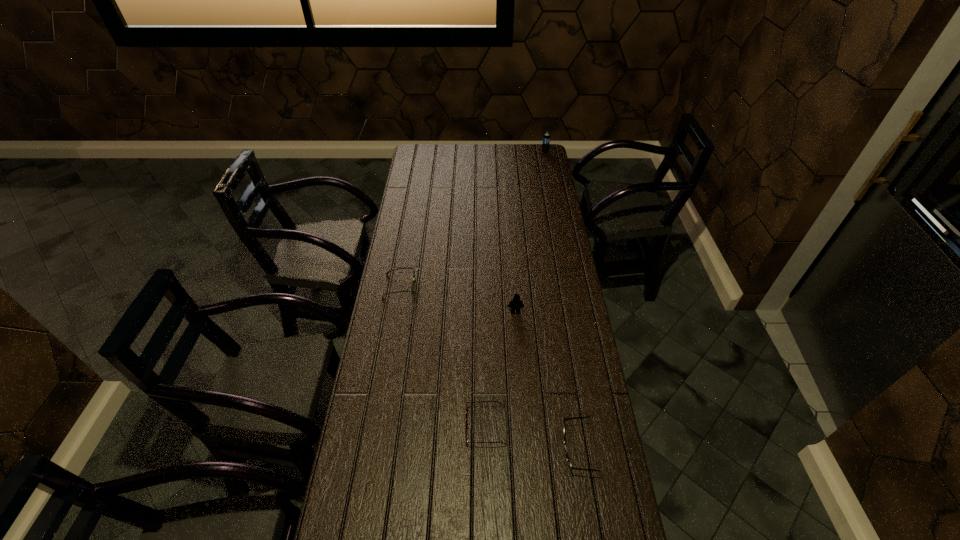
Identify the location of free point located 0.070m on the left of the tallest object. The image size is (960, 540). (529, 152).

The image size is (960, 540). Identify the location of vacant space located 0.380m on the face of the third object from left to right. (522, 406).

The image size is (960, 540). What are the coordinates of `blank space located 0.080m on the front-facing side of the rightmost spectacles` in the screenshot? It's located at (536, 449).

At what (x,y) coordinates should I click in order to perform the action: click on vacant space located on the front-facing side of the rightmost spectacles. Please return your answer as a coordinate pair (x, y). Looking at the image, I should click on (516, 449).

Find the location of a particular element. This screenshot has height=540, width=960. free space located on the front-facing side of the rightmost spectacles is located at coordinates (532, 449).

At what (x,y) coordinates should I click in order to perform the action: click on vacant area situated on the face of the second shortest object. Please return your answer as a coordinate pair (x, y). The height and width of the screenshot is (540, 960). Looking at the image, I should click on (487, 286).

This screenshot has height=540, width=960. What are the coordinates of `vacant region located on the lenses of the shortest spectacles` in the screenshot? It's located at (414, 427).

Locate an element on the screen. vacant region located 0.090m on the lenses of the shortest spectacles is located at coordinates (437, 427).

What are the coordinates of `free space located on the lenses of the shortest spectacles` in the screenshot? It's located at (356, 427).

Locate an element on the screen. Image resolution: width=960 pixels, height=540 pixels. object that is at the far edge is located at coordinates pyautogui.click(x=546, y=138).